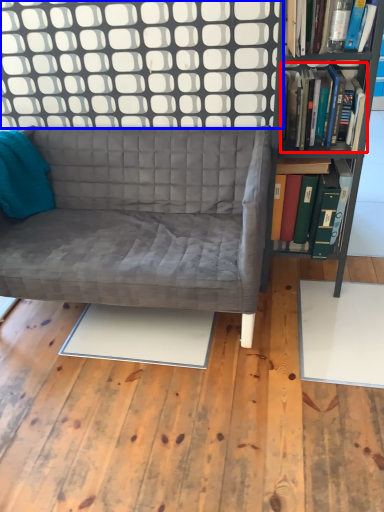
Question: Among these objects, which one is nearest to the camera, book (highlighted by a red box) or glass door (highlighted by a blue box)?

Choices:
 (A) book
 (B) glass door

Answer: (A)